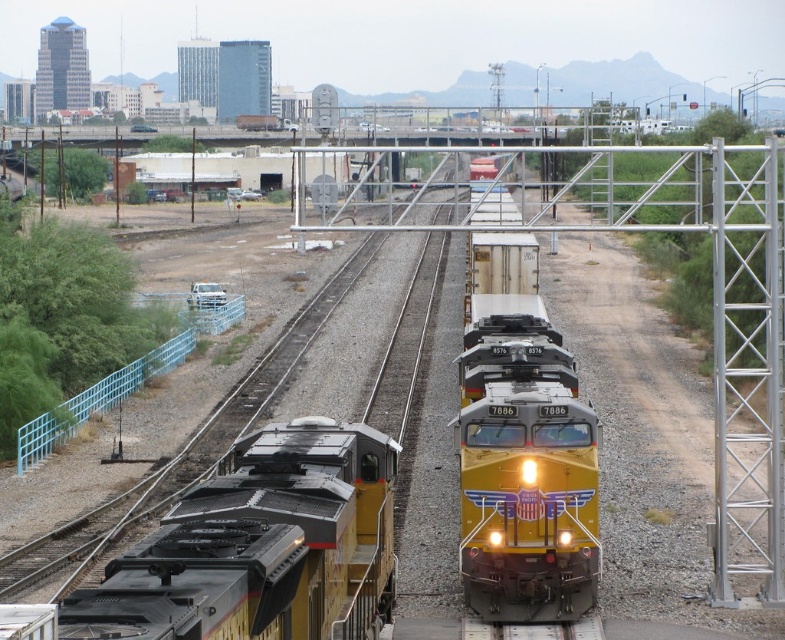
Which of these two, yellow matte train car at lower left or yellow metallic train at center, stands shorter?

Standing shorter between the two is yellow matte train car at lower left.

Can you confirm if yellow matte train car at lower left is positioned to the left of yellow metallic train at center?

Correct, you'll find yellow matte train car at lower left to the left of yellow metallic train at center.

Does point (174, 512) lie behind point (479, 513)?

No, (174, 512) is closer to viewer.

The height and width of the screenshot is (640, 785). In order to click on yellow matte train car at lower left in this screenshot , I will do [x=276, y=532].